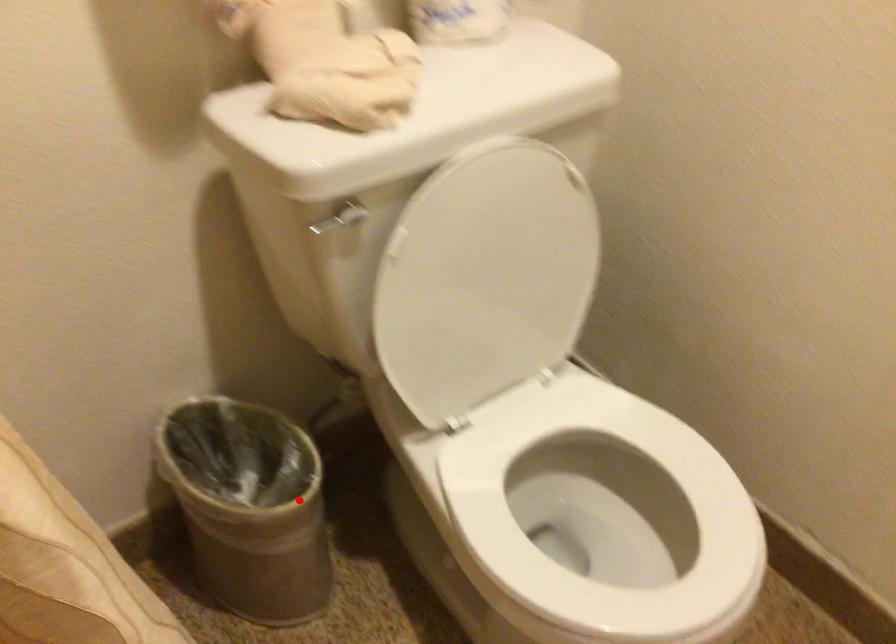
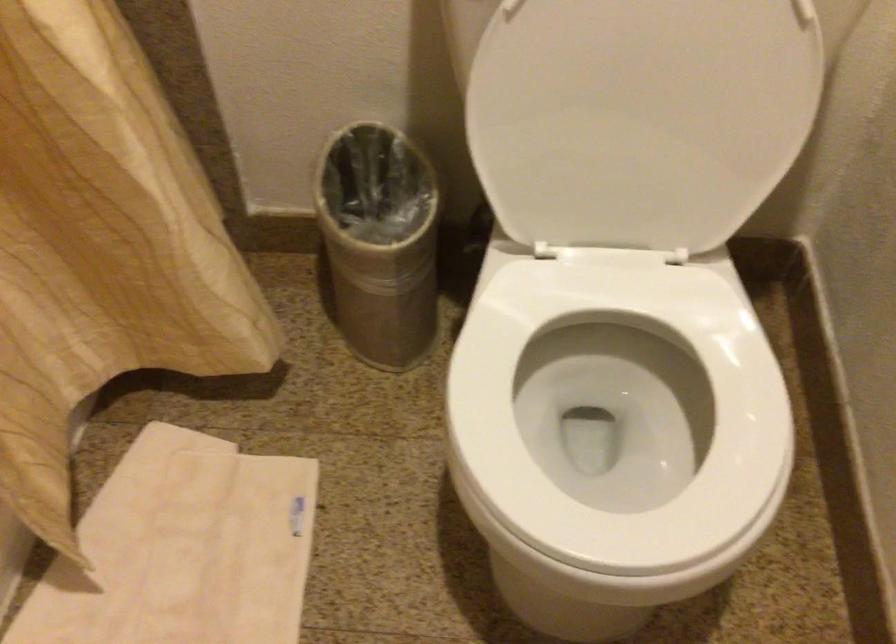
Locate, in the second image, the point that corresponds to the highlighted location in the first image.

(380, 242)